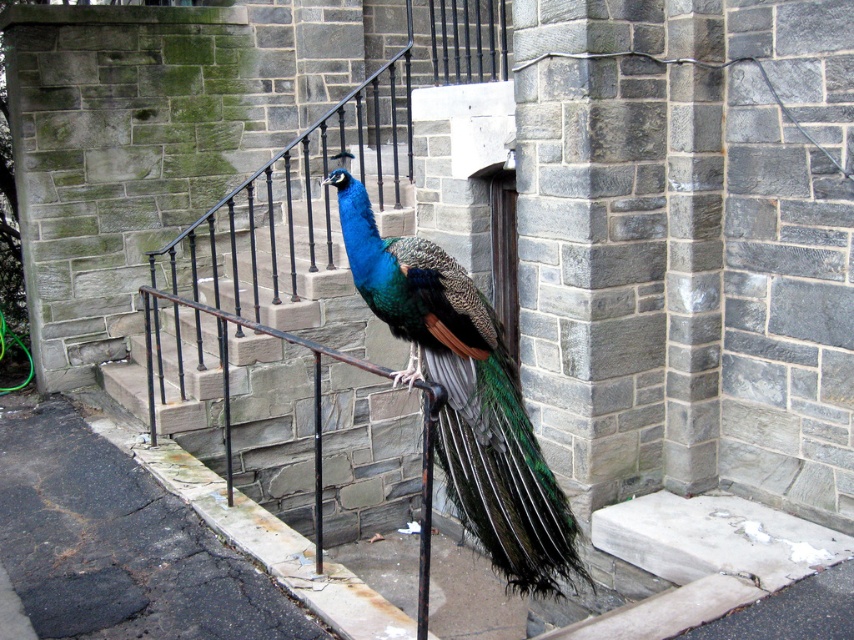
You are standing at the bottom of the gray stone stairs at center and want to reach the shiny blue peacock at center. Which direction should you move to get closer to the peacock?

The shiny blue peacock at center is closer to the viewer than the gray stone stairs at center, so you should move upward along the gray stone stairs at center towards the peacock.

Based on the coordinates provided, where is the shiny blue peacock at center located in the image?

The shiny blue peacock at center is located at the 2D coordinates point (465,397) in the image.

In the scene shown: You are a photographer trying to capture the shiny blue peacock at center and the gray stone stairs at center in a single shot. Based on their sizes, which object should you focus on first to ensure both are in frame?

The shiny blue peacock at center has a smaller size compared to gray stone stairs at center, so you should focus on the gray stone stairs at center first to ensure both are in frame.